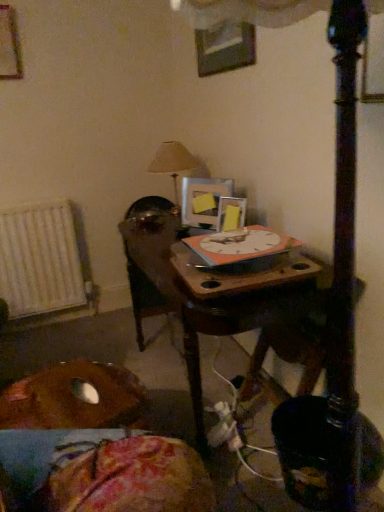
Question: Is brown fabric cushion at lower left inside wooden picture frame at upper left, which ranks as the first picture frame in top-to-bottom order?

Choices:
 (A) yes
 (B) no

Answer: (B)

Question: Is wooden picture frame at upper left, which ranks as the first picture frame in top-to-bottom order, smaller than brown fabric cushion at lower left?

Choices:
 (A) yes
 (B) no

Answer: (B)

Question: Considering the relative positions of wooden picture frame at upper left, acting as the first picture frame starting from the left, and brown fabric cushion at lower left in the image provided, is wooden picture frame at upper left, acting as the first picture frame starting from the left, in front of brown fabric cushion at lower left?

Choices:
 (A) yes
 (B) no

Answer: (B)

Question: From a real-world perspective, is wooden picture frame at upper left, marked as the 4th picture frame in a bottom-to-top arrangement, located higher than brown fabric cushion at lower left?

Choices:
 (A) yes
 (B) no

Answer: (A)

Question: Does wooden picture frame at upper left, which ranks as the first picture frame in top-to-bottom order, have a greater height compared to brown fabric cushion at lower left?

Choices:
 (A) yes
 (B) no

Answer: (A)

Question: Looking at their shapes, would you say white metallic radiator at left is wider or thinner than beige fabric lampshade at upper center?

Choices:
 (A) wide
 (B) thin

Answer: (B)

Question: Based on their positions, is white metallic radiator at left located to the left or right of beige fabric lampshade at upper center?

Choices:
 (A) right
 (B) left

Answer: (B)

Question: From the image's perspective, is white metallic radiator at left positioned above or below beige fabric lampshade at upper center?

Choices:
 (A) below
 (B) above

Answer: (A)

Question: Is point (84, 262) closer or farther from the camera than point (165, 148)?

Choices:
 (A) farther
 (B) closer

Answer: (A)

Question: From a real-world perspective, is white metallic radiator at left positioned above or below brown fabric cushion at lower left?

Choices:
 (A) below
 (B) above

Answer: (B)

Question: Visually, is white metallic radiator at left positioned to the left or to the right of brown fabric cushion at lower left?

Choices:
 (A) right
 (B) left

Answer: (B)

Question: Considering their positions, is white metallic radiator at left located in front of or behind brown fabric cushion at lower left?

Choices:
 (A) behind
 (B) front

Answer: (A)

Question: In terms of width, does white metallic radiator at left look wider or thinner when compared to brown fabric cushion at lower left?

Choices:
 (A) wide
 (B) thin

Answer: (B)

Question: Considering the positions of point (233, 197) and point (200, 193), is point (233, 197) closer or farther from the camera than point (200, 193)?

Choices:
 (A) farther
 (B) closer

Answer: (B)

Question: From a real-world perspective, relative to yellow matte picture frame at upper center, which is the 2th picture frame in left-to-right order, is matte silver picture frame at center, the 1th picture frame viewed from the right, vertically above or below?

Choices:
 (A) above
 (B) below

Answer: (B)